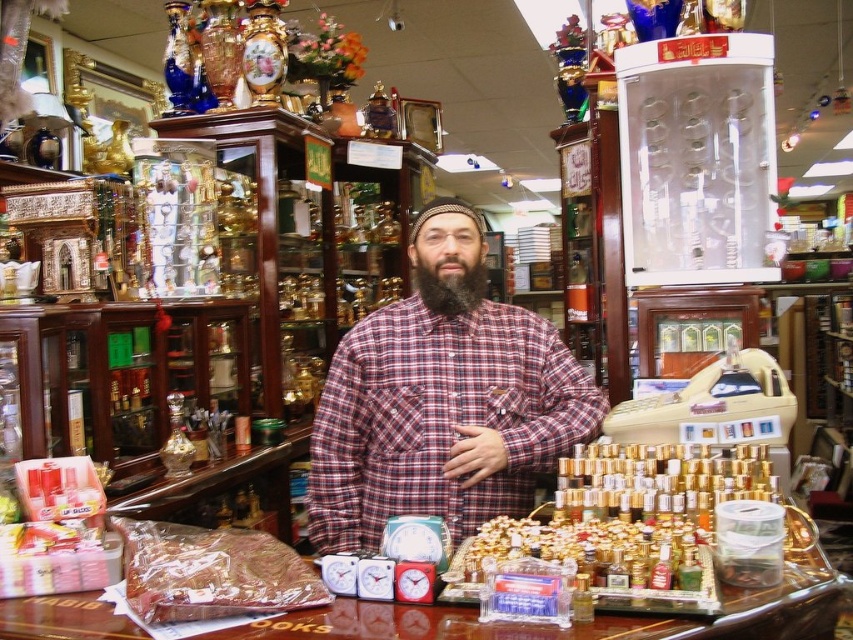
Question: Can you confirm if plaid cotton shirt at center is thinner than translucent plastic bag at lower left?

Choices:
 (A) no
 (B) yes

Answer: (A)

Question: Does plaid cotton shirt at center appear on the left side of translucent plastic bag at lower left?

Choices:
 (A) no
 (B) yes

Answer: (A)

Question: Which object appears farthest from the camera in this image?

Choices:
 (A) translucent plastic bag at lower left
 (B) metallic gold bottles at center

Answer: (B)

Question: Among these objects, which one is nearest to the camera?

Choices:
 (A) plaid cotton shirt at center
 (B) translucent plastic bag at lower left

Answer: (B)

Question: Can you confirm if plaid cotton shirt at center is positioned to the right of translucent plastic bag at lower left?

Choices:
 (A) yes
 (B) no

Answer: (A)

Question: Which point is farther to the camera?

Choices:
 (A) black matte beard at center
 (B) translucent plastic bag at lower left
 (C) plaid cotton shirt at center
 (D) metallic gold bottles at center

Answer: (A)